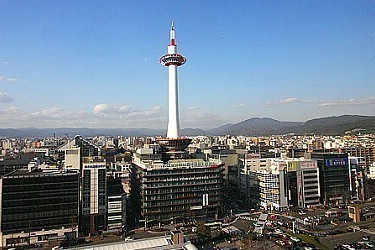
The height and width of the screenshot is (250, 375). What are the coordinates of `viewing area` in the screenshot? It's located at (178, 59).